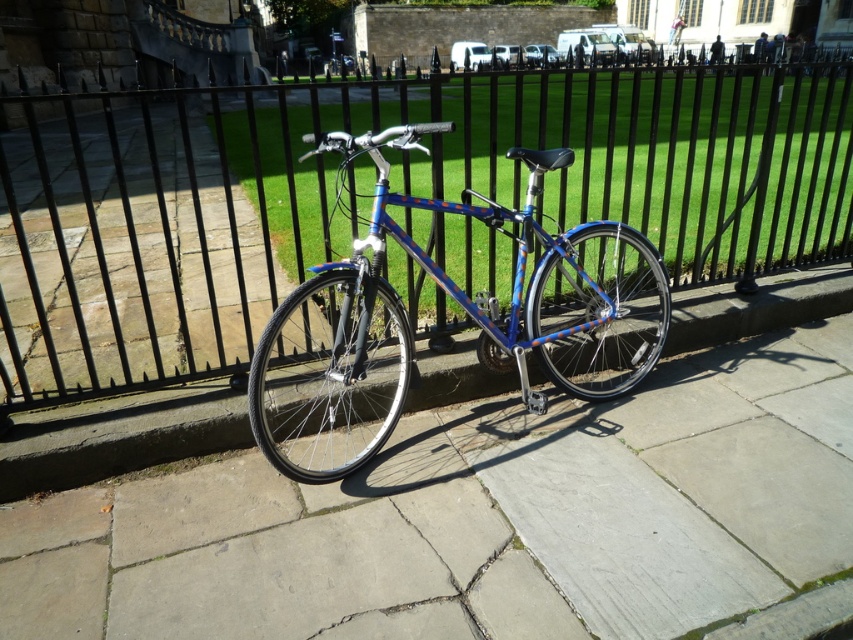
Identify the location of gray concrete pavement at center. (479, 518).

Can you confirm if gray concrete pavement at center is positioned above blue metallic bicycle at center?

No.

I want to click on gray concrete pavement at center, so click(479, 518).

You are a GUI agent. You are given a task and a screenshot of the screen. Output one action in this format:
    pyautogui.click(x=<x>, y=<y>)
    Task: Click on the gray concrete pavement at center
    The height and width of the screenshot is (640, 853).
    Given the screenshot: What is the action you would take?
    pyautogui.click(x=479, y=518)

Who is lower down, black metal fence at center or blue metallic bicycle at center?

blue metallic bicycle at center is below.

Does black metal fence at center have a greater width compared to blue metallic bicycle at center?

Yes.

At what (x,y) coordinates should I click in order to perform the action: click on black metal fence at center. Please return your answer as a coordinate pair (x, y). The width and height of the screenshot is (853, 640). Looking at the image, I should click on (370, 189).

Can you confirm if gray concrete pavement at center is thinner than black metal fence at center?

Yes.

Does point (624, 490) come farther from viewer compared to point (799, 209)?

No, it is not.

This screenshot has width=853, height=640. What are the coordinates of `gray concrete pavement at center` in the screenshot? It's located at (479, 518).